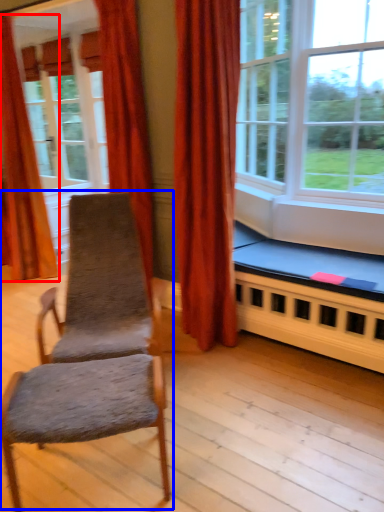
Question: Which object appears farthest to the camera in this image, curtain (highlighted by a red box) or rocking chair (highlighted by a blue box)?

Choices:
 (A) curtain
 (B) rocking chair

Answer: (A)